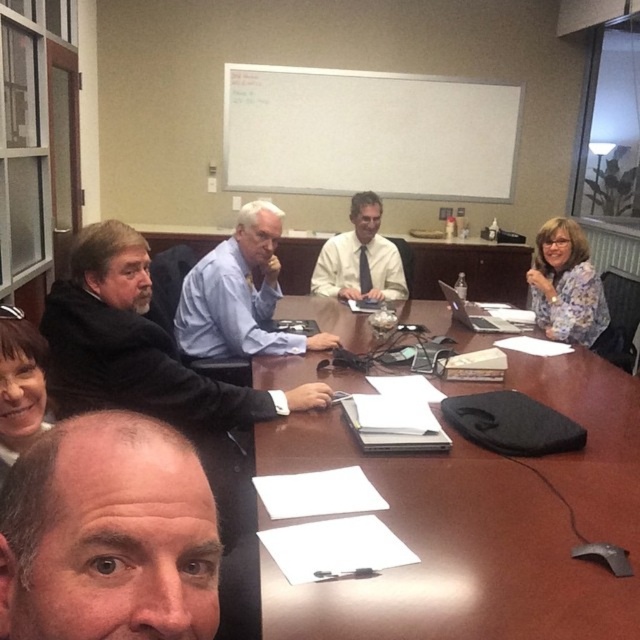
You are a visitor entering the meeting room and see the brown wooden table at center and the black matte jacket at left. Which object is closer to the entrance?

The brown wooden table at center is closer to the entrance because it is shorter than the black matte jacket at left, implying it is positioned in front of the jacket and thus nearer to the entrance.

Looking at this image, you are a new employee attending a meeting in this room. You need to place your laptop on the brown wooden table at center without blocking the black matte jacket at left. Is the table wide enough to accommodate both items?

The brown wooden table at center might be wider than black matte jacket at left, so there is a possibility that the table has enough space to place the laptop without blocking the jacket. However, the exact dimensions are uncertain based on the provided information.

You are a service robot in the conference room. You need to deliver a document to the person with the blue shirt at center and then to the person with smooth brown hair at lower left. Can you reach both of them without moving more than 1.5 meters from your starting position?

The blue shirt at center is 1.39 meters away from smooth brown hair at lower left. Since the distance between them is less than 1.5 meters, the robot can reach both individuals without exceeding the 1.5 meter limit.